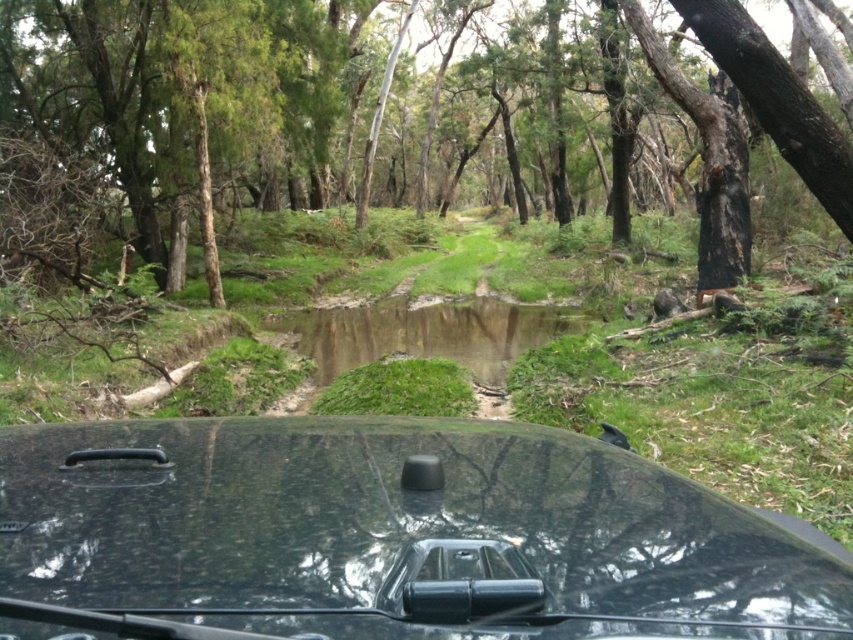
Who is higher up, glossy black car at center or green grassy puddle at center?

glossy black car at center is above.

Between glossy black car at center and green grassy puddle at center, which one appears on the left side from the viewer's perspective?

green grassy puddle at center is more to the left.

Who is more forward, (846, 580) or (451, 323)?

Point (846, 580) is more forward.

The width and height of the screenshot is (853, 640). I want to click on glossy black car at center, so click(x=387, y=536).

Is brown rough tree at center shorter than green grassy puddle at center?

In fact, brown rough tree at center may be taller than green grassy puddle at center.

Is point (666, 177) positioned before point (401, 301)?

No, (666, 177) is behind (401, 301).

I want to click on brown rough tree at center, so click(370, 120).

Is brown rough tree at center above glossy black car at center?

Correct, brown rough tree at center is located above glossy black car at center.

Is brown rough tree at center shorter than glossy black car at center?

No, brown rough tree at center is not shorter than glossy black car at center.

Between point (223, 246) and point (200, 570), which one is positioned in front?

Positioned in front is point (200, 570).

Where is `brown rough tree at center`? brown rough tree at center is located at coordinates (370, 120).